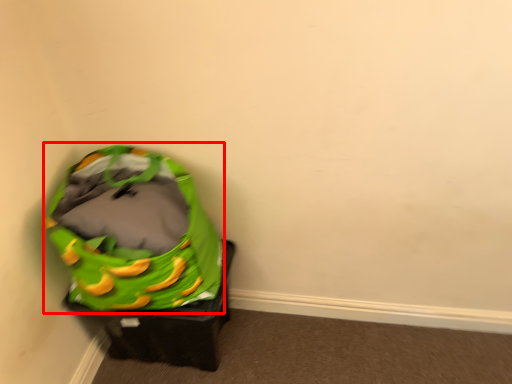
Question: From the image's perspective, where is bean bag chair (annotated by the red box) located in relation to furniture in the image?

Choices:
 (A) below
 (B) above

Answer: (B)